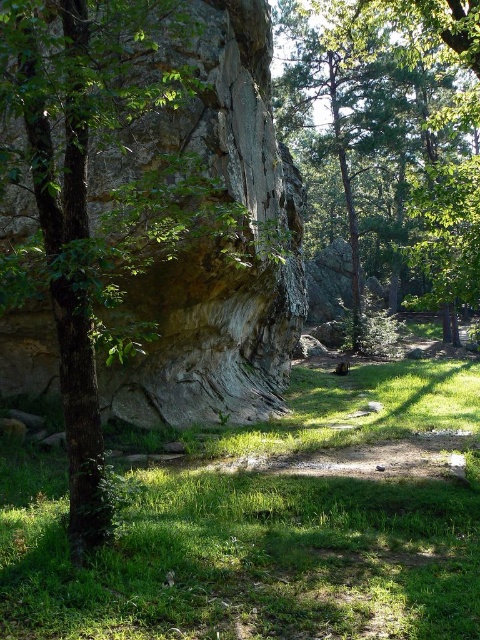
You are standing in the natural setting shown in the image. You see two points marked in the scene, point (276, 186) and point (451, 307). Which point is nearer to you?

Point (276, 186) is closer to the viewer than point (451, 307).

You are standing in the middle of the scene and want to sit down. Which object, the green grassy at center or the green leafy tree at center, is a suitable place to sit?

The green grassy at center is a suitable place to sit because it is located below the green leafy tree at center, making it accessible for sitting.